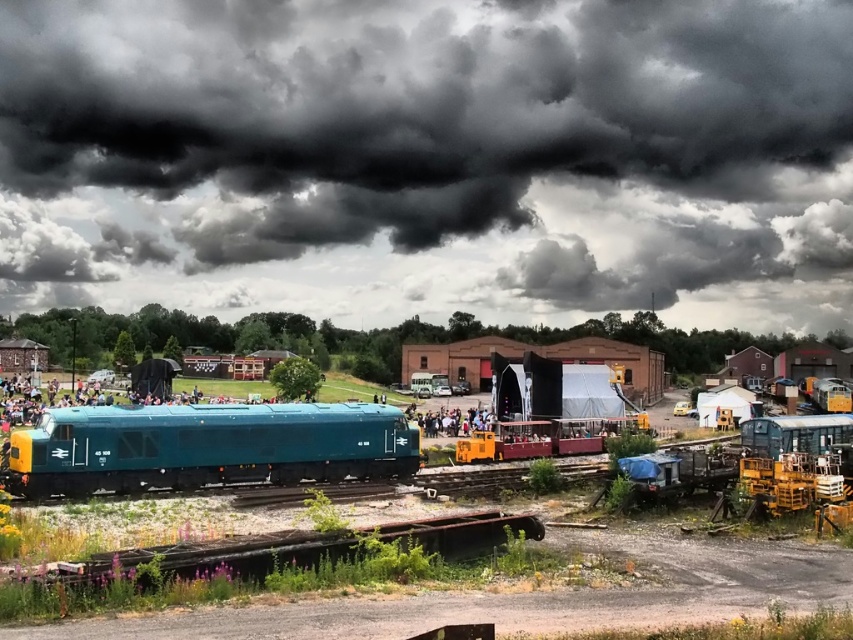
Question: Can you confirm if teal glossy locomotive at center is positioned to the left of green painted metal train at lower right?

Choices:
 (A) no
 (B) yes

Answer: (B)

Question: Does teal glossy locomotive at center appear under green painted metal train at lower right?

Choices:
 (A) no
 (B) yes

Answer: (A)

Question: Which is nearer to the light brown wooden bench at center?

Choices:
 (A) dark gray cloud at upper center
 (B) teal glossy locomotive at center
 (C) green painted metal train at lower right

Answer: (C)

Question: Which object is closer to the camera taking this photo?

Choices:
 (A) dark gray cloud at upper center
 (B) green painted metal train at lower right
 (C) teal glossy locomotive at center

Answer: (B)

Question: Considering the real-world distances, which object is closest to the teal glossy locomotive at center?

Choices:
 (A) dark gray cloud at upper center
 (B) light brown wooden bench at center
 (C) green painted metal train at lower right

Answer: (C)

Question: Can you confirm if green painted metal train at lower right is wider than light brown wooden bench at center?

Choices:
 (A) yes
 (B) no

Answer: (A)